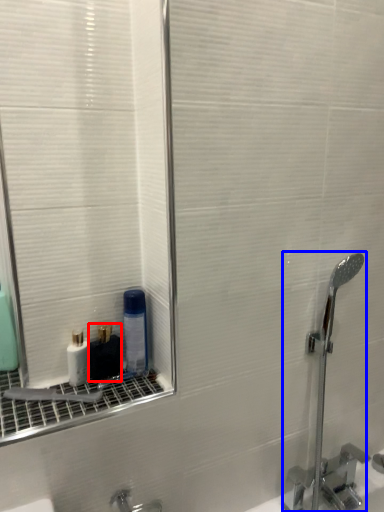
Question: Which of the following is the farthest to the observer, mouthwash (highlighted by a red box) or faucet (highlighted by a blue box)?

Choices:
 (A) mouthwash
 (B) faucet

Answer: (A)